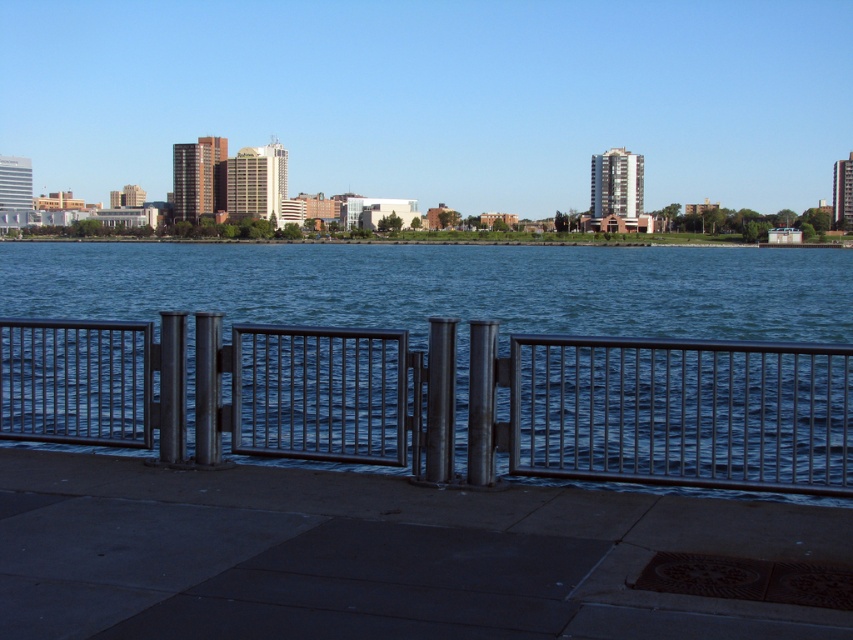
Can you confirm if smooth concrete dock at lower center is positioned above polished metal gate at center?

Actually, smooth concrete dock at lower center is below polished metal gate at center.

Is point (544, 528) closer to viewer compared to point (321, 352)?

Yes, it is in front of point (321, 352).

The width and height of the screenshot is (853, 640). I want to click on smooth concrete dock at lower center, so click(x=372, y=556).